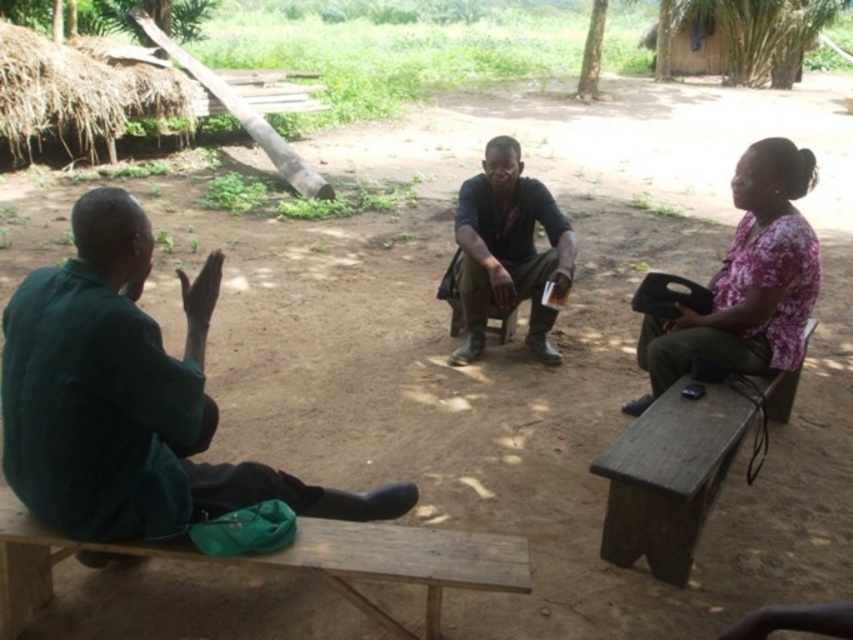
Is green matte shirt at left taller than brown wooden bench at right?

Indeed, green matte shirt at left has a greater height compared to brown wooden bench at right.

From the picture: Is the position of green matte shirt at left less distant than that of brown wooden bench at right?

Yes, green matte shirt at left is closer to the viewer.

Does point (96, 204) lie in front of point (659, 413)?

Yes, it is in front of point (659, 413).

At what (x,y) coordinates should I click in order to perform the action: click on green matte shirt at left. Please return your answer as a coordinate pair (x, y). The image size is (853, 640). Looking at the image, I should click on (129, 397).

Which is in front, point (32, 550) or point (671, 566)?

Point (32, 550) is more forward.

Who is shorter, wooden bench at lower left or brown wooden bench at right?

wooden bench at lower left

Is point (45, 596) behind point (730, 413)?

No, (45, 596) is closer to viewer.

You are a GUI agent. You are given a task and a screenshot of the screen. Output one action in this format:
    pyautogui.click(x=<x>, y=<y>)
    Task: Click on the wooden bench at lower left
    The height and width of the screenshot is (640, 853).
    Given the screenshot: What is the action you would take?
    pyautogui.click(x=285, y=563)

Is point (747, 240) less distant than point (345, 580)?

No.

Between pink floral shirt at upper right and wooden bench at lower left, which one appears on the left side from the viewer's perspective?

wooden bench at lower left

The image size is (853, 640). Find the location of `pink floral shirt at upper right`. pink floral shirt at upper right is located at coordinates (747, 280).

Identify the location of pink floral shirt at upper right. This screenshot has height=640, width=853. (747, 280).